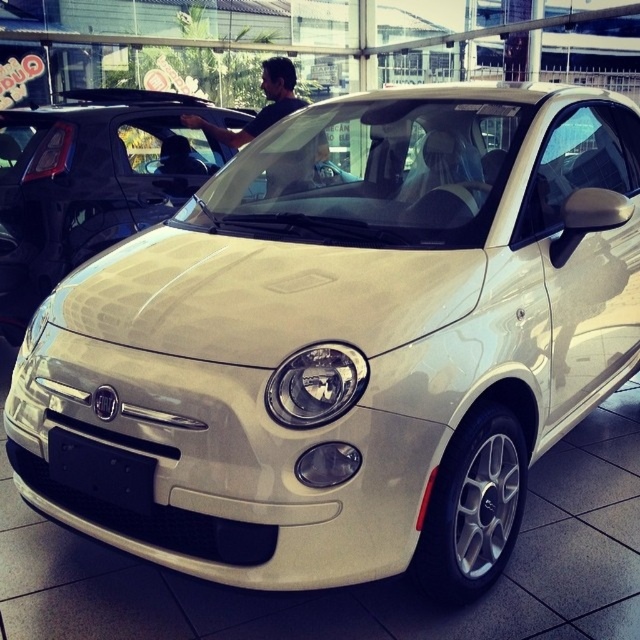
Does black plastic license plate at front have a greater width compared to dark brown leather jacket at center?

Incorrect, black plastic license plate at front's width does not surpass dark brown leather jacket at center's.

The width and height of the screenshot is (640, 640). What are the coordinates of `black plastic license plate at front` in the screenshot? It's located at (100, 472).

Where is `black plastic license plate at front`? This screenshot has width=640, height=640. black plastic license plate at front is located at coordinates (100, 472).

I want to click on black plastic license plate at front, so click(x=100, y=472).

Is point (170, 157) more distant than point (292, 100)?

No, it is in front of (292, 100).

You are a GUI agent. You are given a task and a screenshot of the screen. Output one action in this format:
    pyautogui.click(x=<x>, y=<y>)
    Task: Click on the white glossy car at center
    The height and width of the screenshot is (640, 640).
    Given the screenshot: What is the action you would take?
    pyautogui.click(x=92, y=180)

The image size is (640, 640). I want to click on white glossy car at center, so click(x=92, y=180).

Between point (45, 120) and point (129, 500), which one is positioned behind?

Positioned behind is point (45, 120).

What do you see at coordinates (92, 180) in the screenshot?
I see `white glossy car at center` at bounding box center [92, 180].

The width and height of the screenshot is (640, 640). I want to click on white glossy car at center, so click(92, 180).